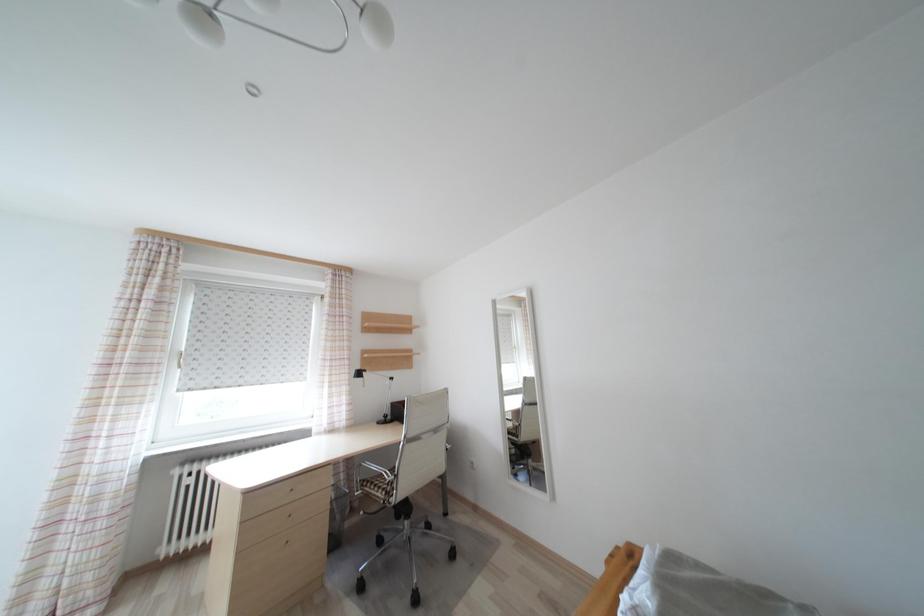
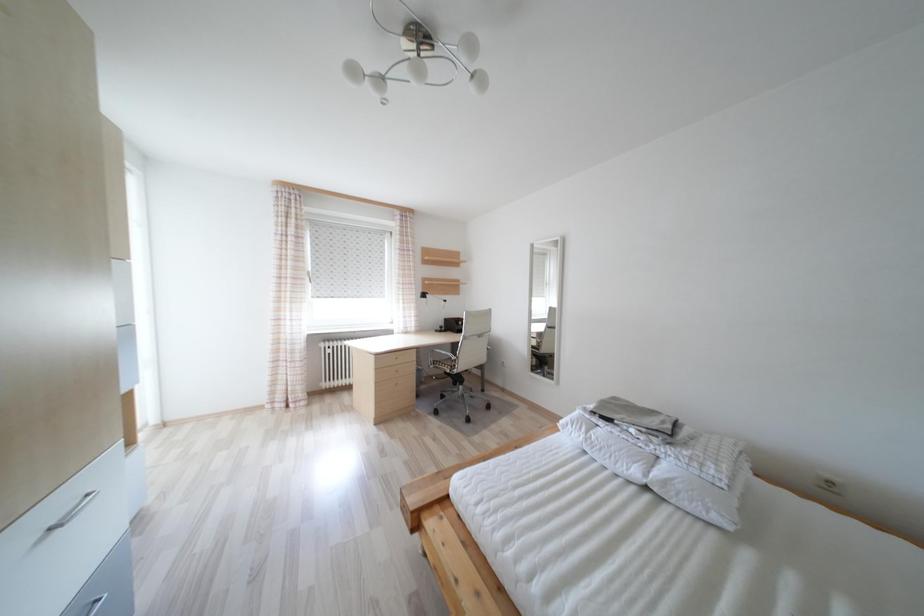
Question: The first image is from the beginning of the video and the second image is from the end. How did the camera likely rotate when shooting the video?

Choices:
 (A) Left
 (B) Right
 (C) Up
 (D) Down

Answer: (D)